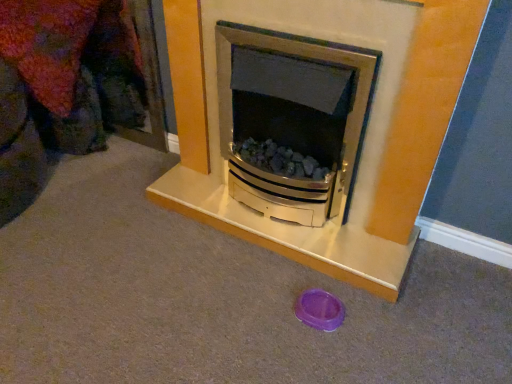
Locate an element on the screen. vacant area that is in front of metallic silver fireplace at center is located at coordinates (266, 311).